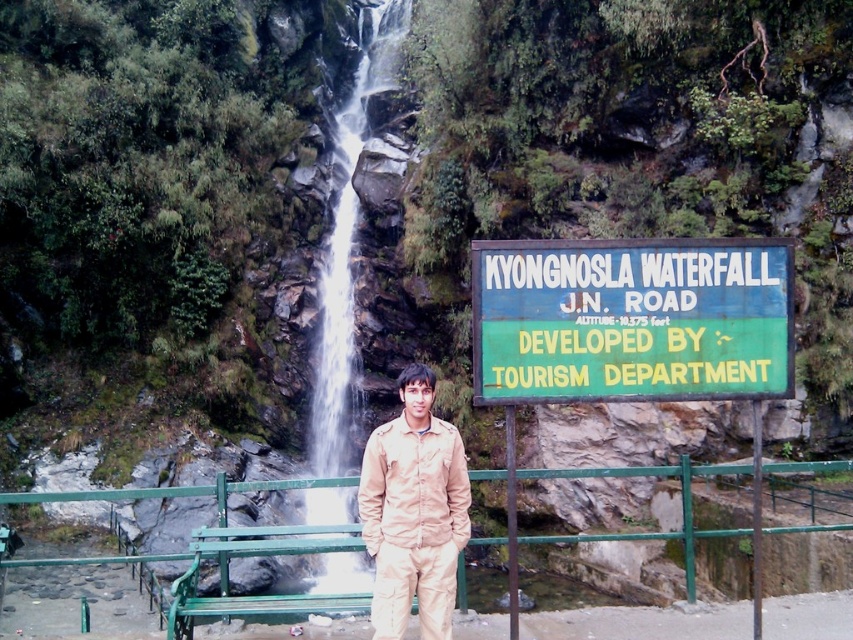
You are a tourist at Kyongnosla Waterfall and want to take a photo of the white smooth water at center while also including the green painted sign at right in the frame. Based on their sizes, will the sign be smaller or larger in the photo compared to the water?

The green painted sign at right has a smaller size compared to white smooth water at center, so in the photo, the sign will appear smaller than the water.

You are a hiker who wants to take a photo of the Kyongnosla Waterfall. You have a camera with a standard lens that can capture objects up to 2 meters tall. The green painted sign at right and the beige fabric jacket at center are in your frame. Which object would you focus on to ensure it fits entirely within the camera frame if the sign is shorter than the jacket?

The green painted sign at right is shorter than the beige fabric jacket at center, so focusing on the green painted sign at right ensures it fits entirely within the camera frame since it is smaller in height.